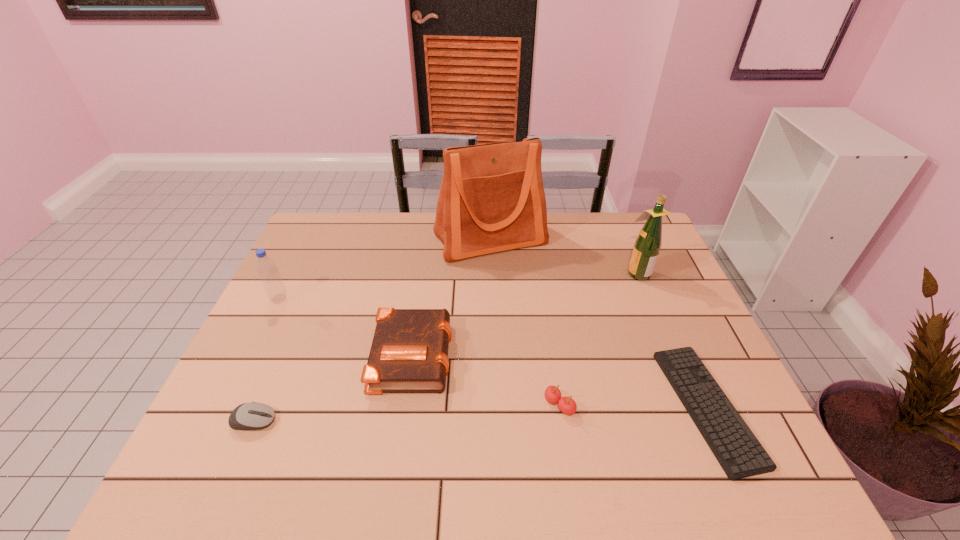
Where is `the tallest object`? The width and height of the screenshot is (960, 540). the tallest object is located at coordinates (492, 199).

Image resolution: width=960 pixels, height=540 pixels. Find the location of `the second tallest object`. the second tallest object is located at coordinates (x=647, y=246).

Identify the location of the fifth shortest object. (266, 267).

Find the location of a particular element. the leftmost object is located at coordinates (266, 267).

You are a GUI agent. You are given a task and a screenshot of the screen. Output one action in this format:
    pyautogui.click(x=<x>, y=<y>)
    Task: Click on the Bible
    
    Given the screenshot: What is the action you would take?
    pyautogui.click(x=408, y=354)

Find the location of a particular element. The width and height of the screenshot is (960, 540). cherry is located at coordinates (567, 405).

This screenshot has height=540, width=960. What are the coordinates of `computer equipment` in the screenshot? It's located at (x=248, y=416).

Find the location of `the sixth tallest object`. the sixth tallest object is located at coordinates (248, 416).

Identify the location of the shortest object. (738, 451).

Locate an element on the screen. The width and height of the screenshot is (960, 540). vacant space situated on the right of the shopping bag is located at coordinates (609, 240).